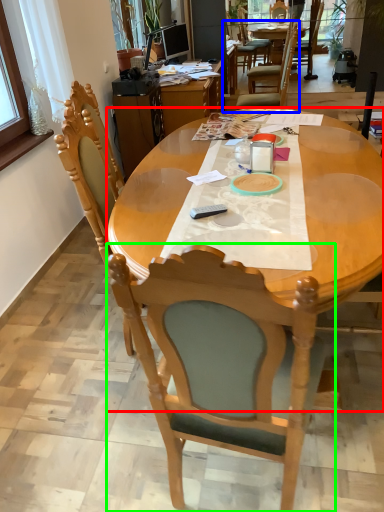
Question: Based on their relative distances, which object is farther from kitchen & dining room table (highlighted by a red box)? Choose from chair (highlighted by a blue box) and chair (highlighted by a green box).

Choices:
 (A) chair
 (B) chair

Answer: (A)